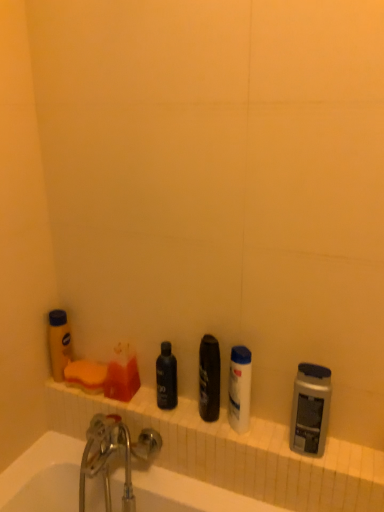
This screenshot has height=512, width=384. I want to click on free location above white ceramic ledge at lower center (from a real-world perspective), so click(202, 412).